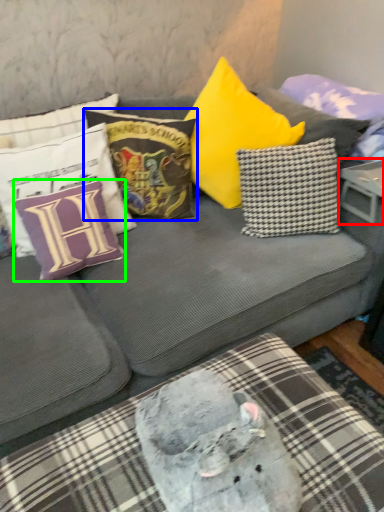
Question: Which object is positioned closest to table (highlighted by a red box)? Select from pillow (highlighted by a blue box) and pillow (highlighted by a green box).

Choices:
 (A) pillow
 (B) pillow

Answer: (A)